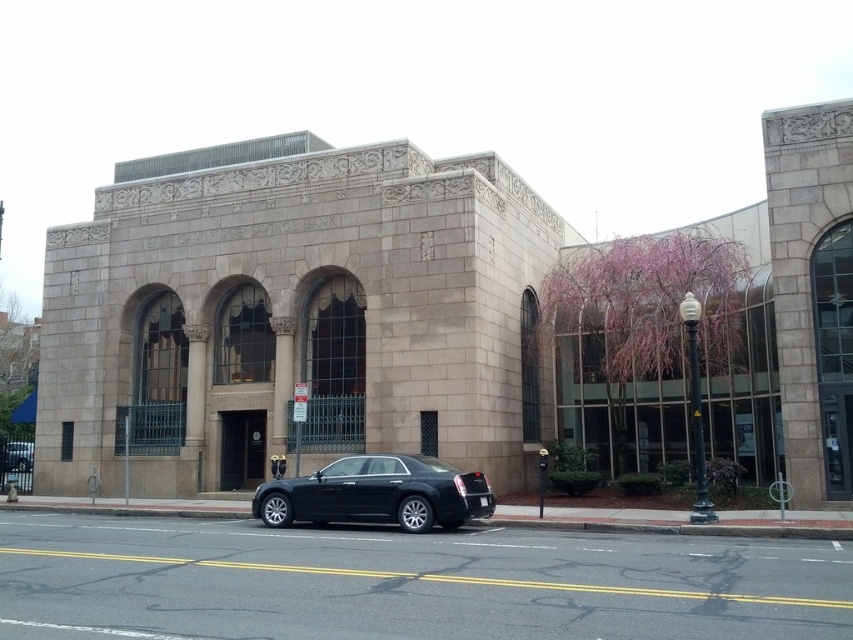
Is black metallic sedan at center below black glossy sedan at center?

No.

Between point (453, 474) and point (24, 451), which one is positioned in front?

Point (453, 474) is more forward.

Locate an element on the screen. black metallic sedan at center is located at coordinates (376, 493).